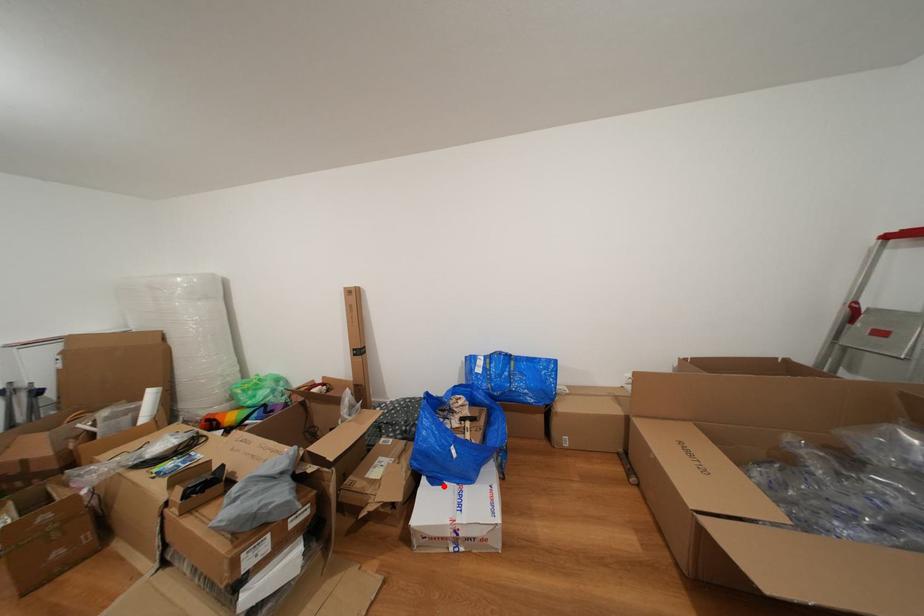
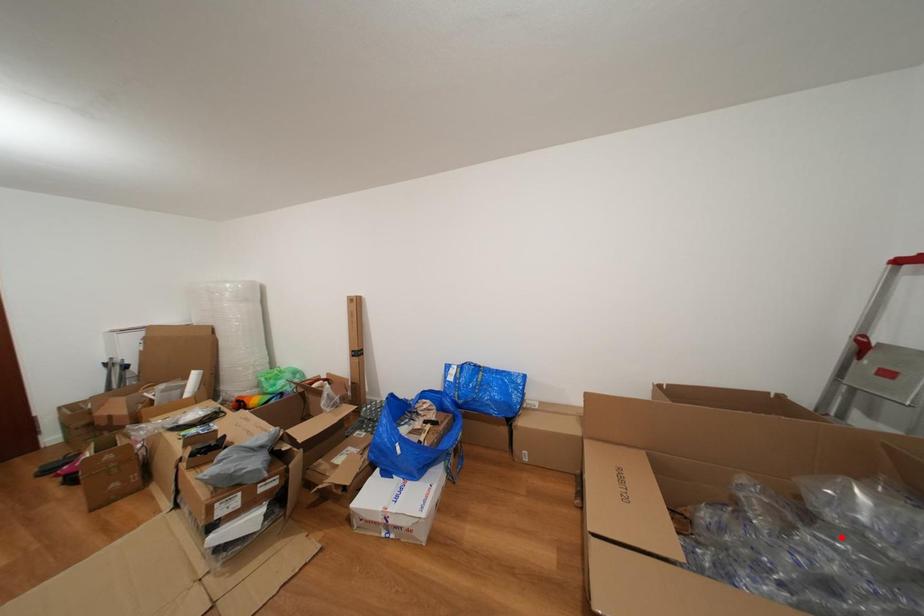
I am providing you with two images of the same scene from different viewpoints. A red point is marked on the first image and another point is marked on the second image. Does the point marked in image1 correspond to the same location as the one in image2?

No